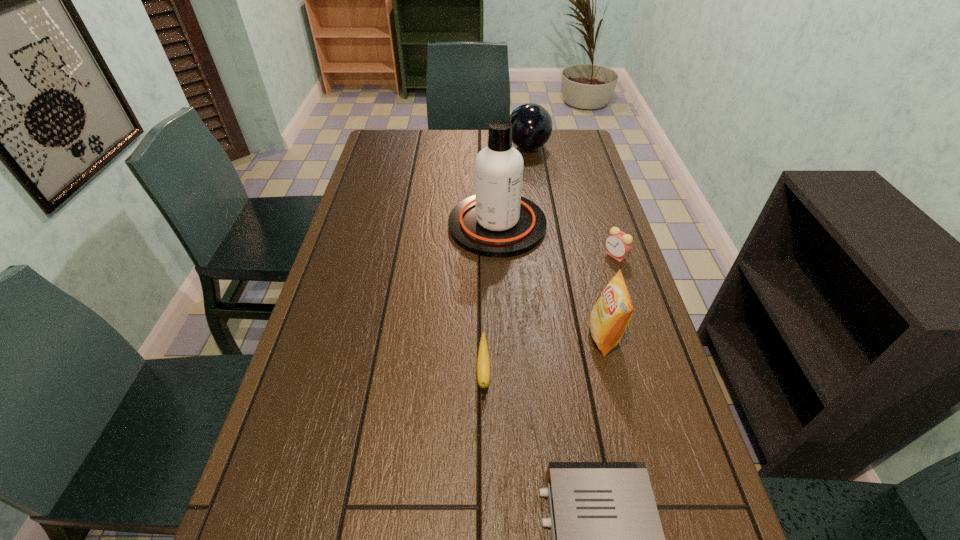
The image size is (960, 540). In order to click on vacant region that satisfies the following two spatial constraints: 1. on the face of the alarm clock; 2. at the stem of the banana in this screenshot , I will do `click(654, 373)`.

Locate an element on the screen. vacant position in the image that satisfies the following two spatial constraints: 1. on the side of the bowling ball with the finger holes; 2. at the stem of the banana is located at coordinates (563, 373).

The image size is (960, 540). Find the location of `blank space that satisfies the following two spatial constraints: 1. on the side of the farthest object with the finger holes; 2. at the stem of the banana`. blank space that satisfies the following two spatial constraints: 1. on the side of the farthest object with the finger holes; 2. at the stem of the banana is located at coordinates (563, 373).

This screenshot has width=960, height=540. In order to click on free spot that satisfies the following two spatial constraints: 1. on the front-facing side of the crisp (potato chip); 2. at the stem of the banana in this screenshot , I will do `click(612, 373)`.